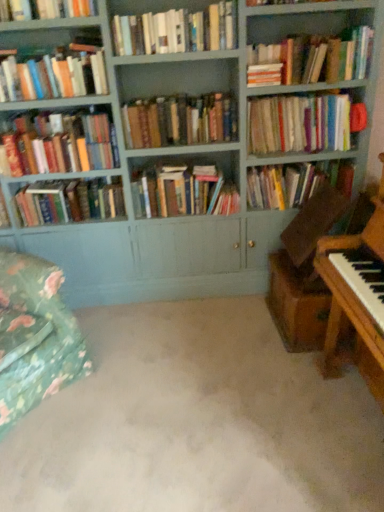
Question: Is hardcover book at upper left, arranged as the 2th book when viewed from the left, at the right side of hardcover books at upper right, marked as the eighth book in a left-to-right arrangement?

Choices:
 (A) no
 (B) yes

Answer: (A)

Question: Is hardcover book at upper left, arranged as the 2th book when viewed from the left, beside hardcover books at upper right, the 3th book viewed from the right?

Choices:
 (A) no
 (B) yes

Answer: (A)

Question: From a real-world perspective, is hardcover book at upper left, acting as the 9th book starting from the right, under hardcover books at upper right, the 3th book viewed from the right?

Choices:
 (A) no
 (B) yes

Answer: (A)

Question: Could you tell me if hardcover book at upper left, arranged as the 2th book when viewed from the left, is turned towards hardcover books at upper right, the 3th book viewed from the right?

Choices:
 (A) yes
 (B) no

Answer: (B)

Question: Considering the relative sizes of hardcover book at upper left, acting as the 9th book starting from the right, and hardcover books at upper right, the 3th book viewed from the right, in the image provided, is hardcover book at upper left, acting as the 9th book starting from the right, taller than hardcover books at upper right, the 3th book viewed from the right,?

Choices:
 (A) yes
 (B) no

Answer: (B)

Question: From the image's perspective, is green floral fabric swivel chair at lower left positioned above or below hardcover book at upper left, acting as the 9th book starting from the right?

Choices:
 (A) below
 (B) above

Answer: (A)

Question: Visually, is green floral fabric swivel chair at lower left positioned to the left or to the right of hardcover book at upper left, arranged as the 2th book when viewed from the left?

Choices:
 (A) right
 (B) left

Answer: (B)

Question: In terms of width, does green floral fabric swivel chair at lower left look wider or thinner when compared to hardcover book at upper left, arranged as the 2th book when viewed from the left?

Choices:
 (A) thin
 (B) wide

Answer: (B)

Question: Is green floral fabric swivel chair at lower left taller or shorter than hardcover book at upper left, arranged as the 2th book when viewed from the left?

Choices:
 (A) short
 (B) tall

Answer: (B)

Question: In the image, is matte hardcover book at left, the 4th book positioned from the left, on the left side or the right side of hardcover books at upper left, arranged as the first book when viewed from the left?

Choices:
 (A) left
 (B) right

Answer: (B)

Question: From the image's perspective, relative to hardcover books at upper left, the tenth book positioned from the right, is matte hardcover book at left, the 7th book positioned from the right, above or below?

Choices:
 (A) above
 (B) below

Answer: (B)

Question: Based on their sizes in the image, would you say matte hardcover book at left, the 4th book positioned from the left, is bigger or smaller than hardcover books at upper left, the tenth book positioned from the right?

Choices:
 (A) big
 (B) small

Answer: (B)

Question: Looking at their shapes, would you say matte hardcover book at left, the 4th book positioned from the left, is wider or thinner than hardcover books at upper left, arranged as the first book when viewed from the left?

Choices:
 (A) thin
 (B) wide

Answer: (B)

Question: Is hardcover book at upper left, acting as the 9th book starting from the right, to the left or to the right of green floral fabric swivel chair at lower left in the image?

Choices:
 (A) right
 (B) left

Answer: (A)

Question: Considering their positions, is hardcover book at upper left, acting as the 9th book starting from the right, located in front of or behind green floral fabric swivel chair at lower left?

Choices:
 (A) behind
 (B) front

Answer: (A)